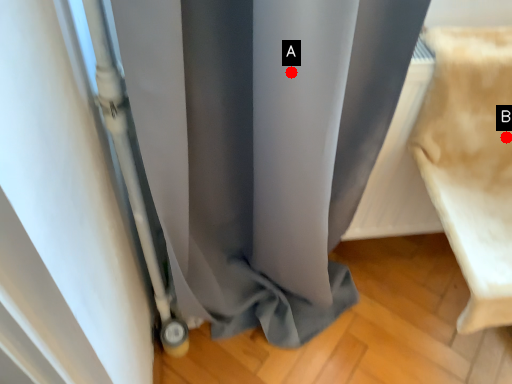
Question: Two points are circled on the image, labeled by A and B beside each circle. Among these points, which one is nearest to the camera?

Choices:
 (A) A is closer
 (B) B is closer

Answer: (A)